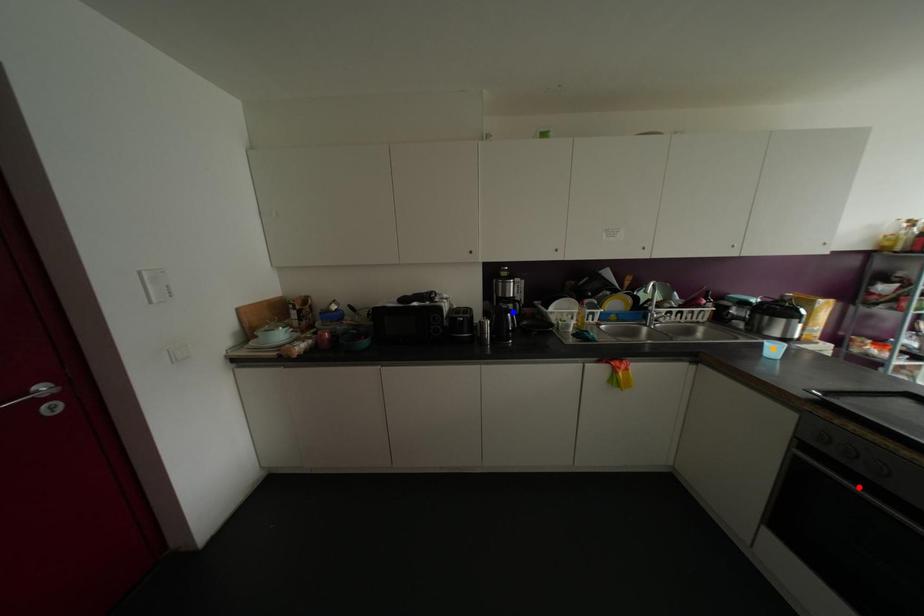
Order these from nearest to farthest:
orange point
blue point
red point

red point < orange point < blue point